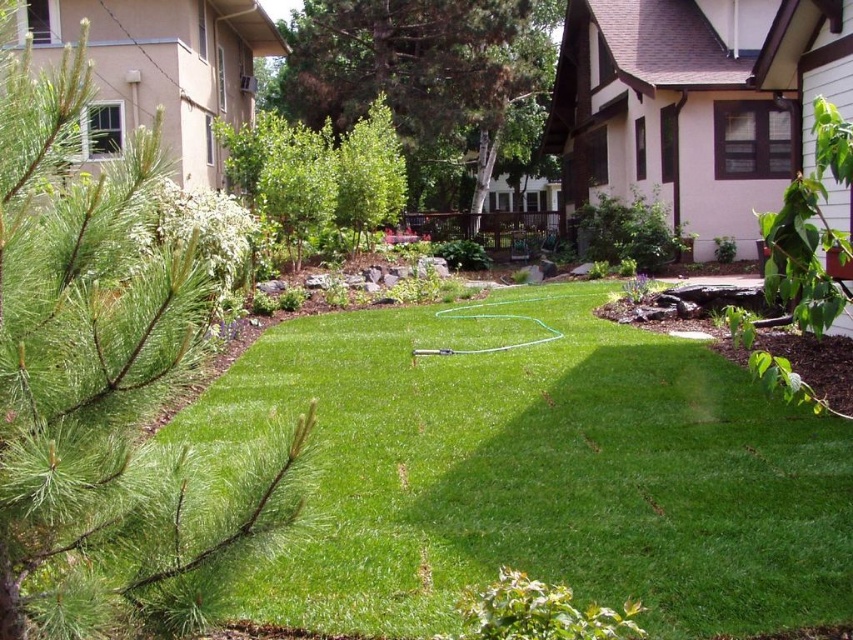
You are standing in the backyard and want to walk from the green leafy tree at center to the green leafy tree at upper center. Which direction should you face to walk directly towards it?

You should face to the right because the green leafy tree at upper center is located to the right of the green leafy tree at center.